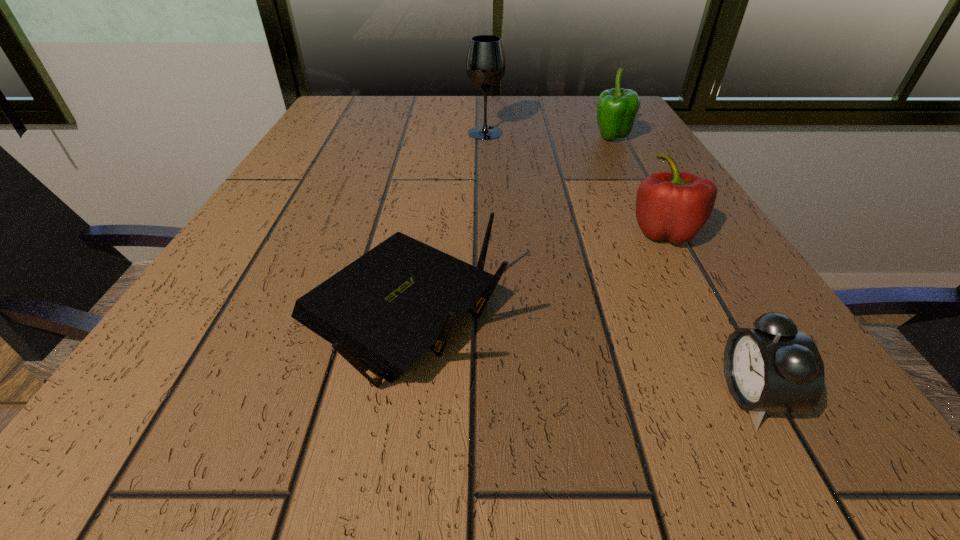
Where is `empty location between the tallest object and the nearer bell pepper`? empty location between the tallest object and the nearer bell pepper is located at coordinates (575, 182).

I want to click on unoccupied position between the alarm clock and the fourth shortest object, so click(x=682, y=266).

The height and width of the screenshot is (540, 960). In order to click on empty space that is in between the tallest object and the fourth shortest object in this screenshot , I will do `click(548, 136)`.

You are a GUI agent. You are given a task and a screenshot of the screen. Output one action in this format:
    pyautogui.click(x=<x>, y=<y>)
    Task: Click on the free point between the tallest object and the router
    
    Given the screenshot: What is the action you would take?
    pyautogui.click(x=442, y=224)

Where is `free space between the nearer bell pepper and the second tallest object`? free space between the nearer bell pepper and the second tallest object is located at coordinates (637, 185).

Image resolution: width=960 pixels, height=540 pixels. In order to click on free point between the nearer bell pepper and the alarm clock in this screenshot , I will do `click(708, 313)`.

Where is `vacant region between the wineglass and the nearer bell pepper`? vacant region between the wineglass and the nearer bell pepper is located at coordinates (575, 182).

At what (x,y) coordinates should I click in order to perform the action: click on vacant area that lies between the nearer bell pepper and the wineglass. Please return your answer as a coordinate pair (x, y). The height and width of the screenshot is (540, 960). Looking at the image, I should click on (575, 182).

The image size is (960, 540). In order to click on free point between the alarm clock and the shorter bell pepper in this screenshot , I will do `click(708, 313)`.

Choose which object is the second nearest neighbor to the tallest object. Please provide its 2D coordinates. Your answer should be formatted as a tuple, i.e. [(x, y)], where the tuple contains the x and y coordinates of a point satisfying the conditions above.

[(675, 206)]